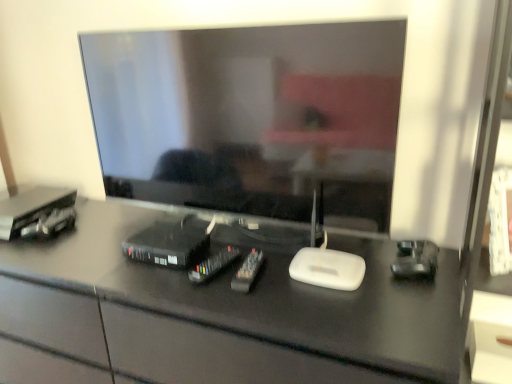
Question: Can you confirm if matte black television at center is smaller than black glossy desk at center?

Choices:
 (A) no
 (B) yes

Answer: (B)

Question: Is matte black television at center facing towards black glossy desk at center?

Choices:
 (A) yes
 (B) no

Answer: (B)

Question: Is matte black television at center looking in the opposite direction of black glossy desk at center?

Choices:
 (A) yes
 (B) no

Answer: (B)

Question: Considering the relative sizes of matte black television at center and black glossy desk at center in the image provided, is matte black television at center taller than black glossy desk at center?

Choices:
 (A) no
 (B) yes

Answer: (A)

Question: Does matte black television at center touch black glossy desk at center?

Choices:
 (A) yes
 (B) no

Answer: (B)

Question: Is black plastic remote control at center, the second equipment viewed from the right, wider or thinner than black plastic remote controls at center, the 4th equipment when ordered from left to right?

Choices:
 (A) thin
 (B) wide

Answer: (A)

Question: From a real-world perspective, is black plastic remote control at center, the second equipment viewed from the right, physically located above or below black plastic remote controls at center, the 1th equipment when ordered from right to left?

Choices:
 (A) above
 (B) below

Answer: (B)

Question: From their relative heights in the image, would you say black plastic remote control at center, the second equipment viewed from the right, is taller or shorter than black plastic remote controls at center, the 4th equipment when ordered from left to right?

Choices:
 (A) tall
 (B) short

Answer: (B)

Question: From the image's perspective, is black plastic remote control at center, the 3th equipment in the left-to-right sequence, positioned above or below black plastic remote controls at center, the 4th equipment when ordered from left to right?

Choices:
 (A) below
 (B) above

Answer: (B)

Question: Considering the relative positions of black plastic remote controls at center, the 4th equipment when ordered from left to right, and matte black television at center in the image provided, is black plastic remote controls at center, the 4th equipment when ordered from left to right, to the left or to the right of matte black television at center?

Choices:
 (A) right
 (B) left

Answer: (A)

Question: In terms of height, does black plastic remote controls at center, the 1th equipment when ordered from right to left, look taller or shorter compared to matte black television at center?

Choices:
 (A) tall
 (B) short

Answer: (B)

Question: In terms of size, does black plastic remote controls at center, the 1th equipment when ordered from right to left, appear bigger or smaller than matte black television at center?

Choices:
 (A) small
 (B) big

Answer: (A)

Question: Considering their positions, is black plastic remote controls at center, the 1th equipment when ordered from right to left, located in front of or behind matte black television at center?

Choices:
 (A) behind
 (B) front

Answer: (A)

Question: From a real-world perspective, is black plastic remote controls at center, the 4th equipment when ordered from left to right, above or below metallic black cable box at left, placed as the 4th equipment when sorted from right to left?

Choices:
 (A) above
 (B) below

Answer: (B)

Question: Looking at the image, does black plastic remote controls at center, the 4th equipment when ordered from left to right, seem bigger or smaller compared to metallic black cable box at left, marked as the first equipment in a left-to-right arrangement?

Choices:
 (A) small
 (B) big

Answer: (A)